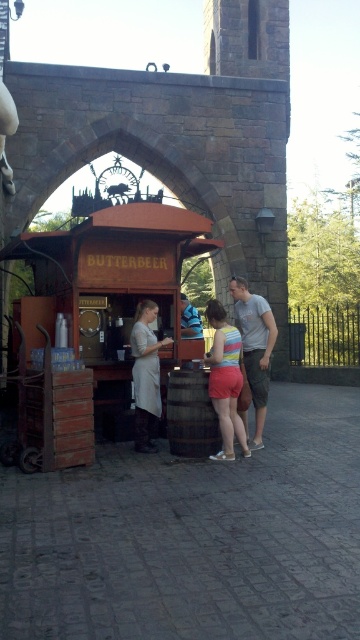
You are a customer at the BUTTERBEER stall and want to order a drink. You notice the brown wooden barrel at lower center and the white fabric apron at center. Which object is located to the right of the other?

The brown wooden barrel at lower center is positioned on the right side of white fabric apron at center.